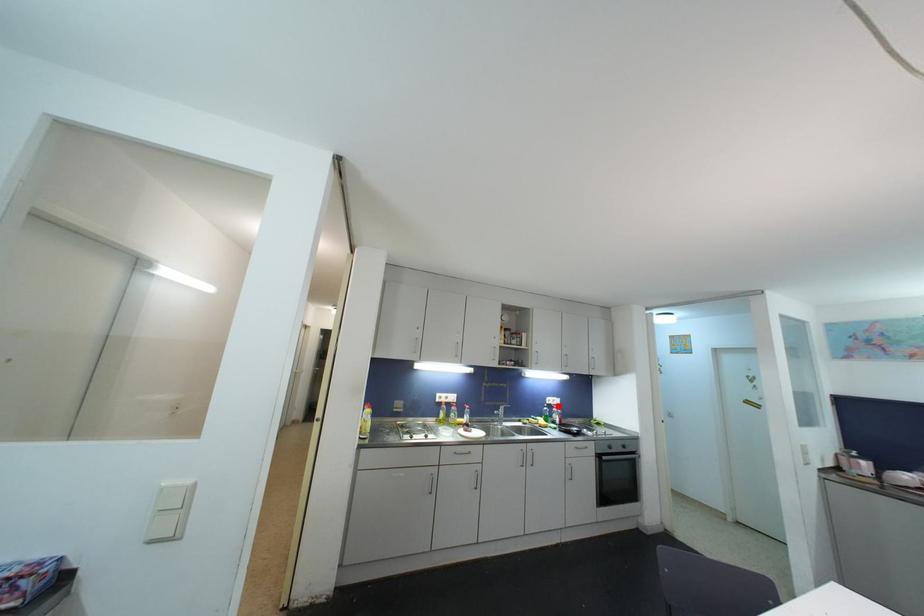
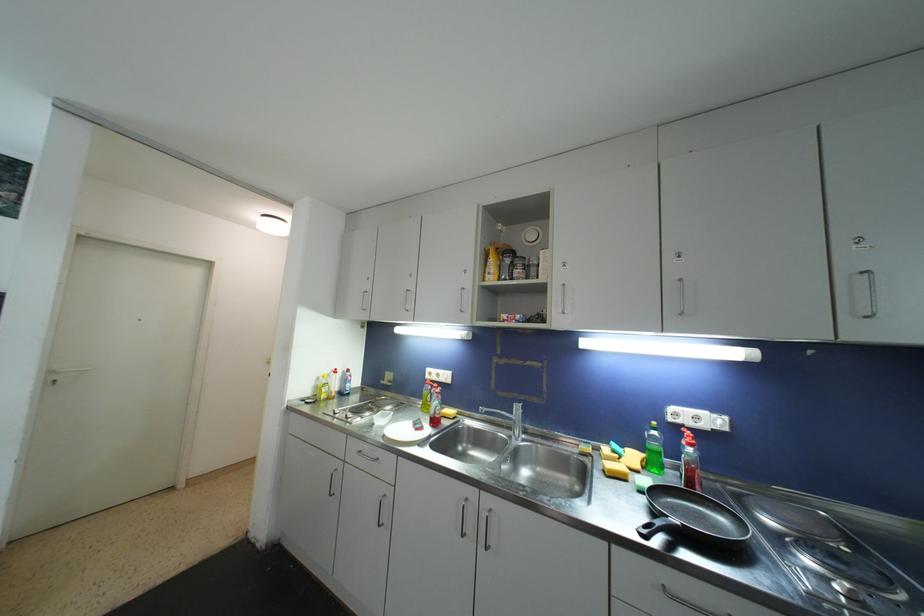
The point at the highlighted location is marked in the first image. Where is the corresponding point in the second image?

(708, 429)